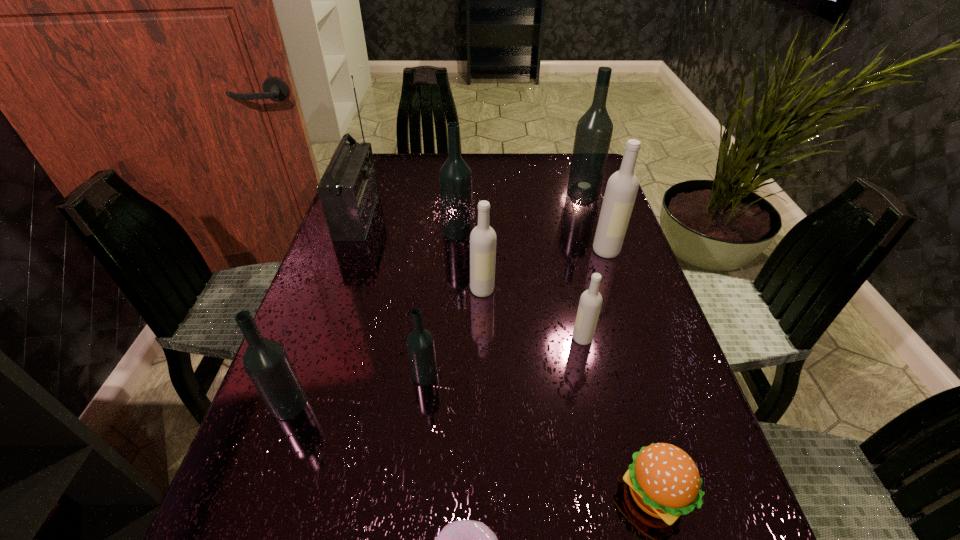
Locate an element on the screen. Image resolution: width=960 pixels, height=540 pixels. the farthest black vodka is located at coordinates (594, 129).

At what (x,y) coordinates should I click in order to perform the action: click on the tallest vodka. Please return your answer as a coordinate pair (x, y). This screenshot has width=960, height=540. Looking at the image, I should click on (594, 129).

You are a GUI agent. You are given a task and a screenshot of the screen. Output one action in this format:
    pyautogui.click(x=<x>, y=<y>)
    Task: Click on the radio receiver
    
    Given the screenshot: What is the action you would take?
    pyautogui.click(x=348, y=190)

Locate an element on the screen. the third farthest vodka is located at coordinates (622, 187).

The height and width of the screenshot is (540, 960). Find the location of `the farthest white vodka`. the farthest white vodka is located at coordinates (622, 187).

Where is `the third nearest black vodka`? the third nearest black vodka is located at coordinates (455, 177).

At what (x,y) coordinates should I click in order to perform the action: click on the second farthest vodka. Please return your answer as a coordinate pair (x, y). Looking at the image, I should click on (455, 177).

This screenshot has width=960, height=540. Find the location of `the second farthest white vodka`. the second farthest white vodka is located at coordinates (483, 237).

What are the coordinates of `the sixth nearest object` in the screenshot? It's located at (483, 237).

Identify the location of the nearest vodka. Image resolution: width=960 pixels, height=540 pixels. (266, 362).